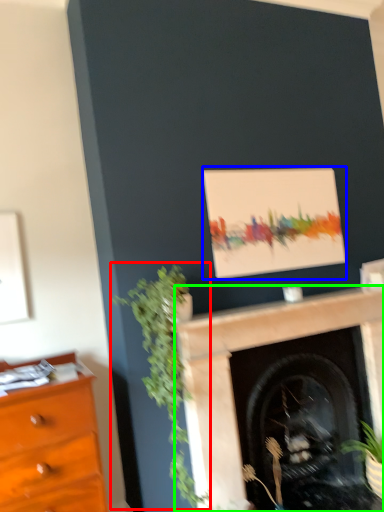
Question: Considering the real-world distances, which object is closest to plant (highlighted by a red box)? picture frame (highlighted by a blue box) or fireplace (highlighted by a green box).

Choices:
 (A) picture frame
 (B) fireplace

Answer: (B)